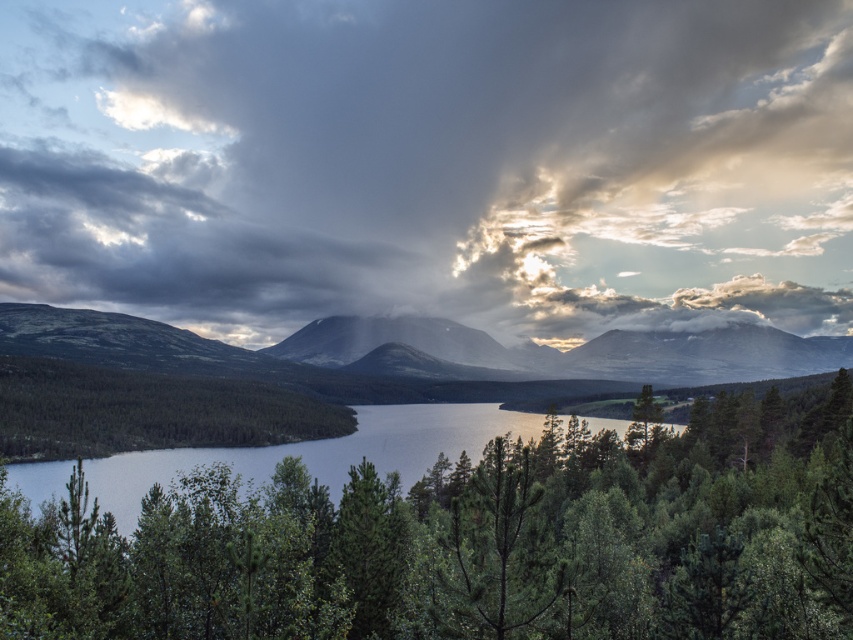
Consider the image. Can you confirm if green leafy tree at center is taller than smooth gray mountain at center?

No, green leafy tree at center is not taller than smooth gray mountain at center.

Does green leafy tree at center appear on the right side of smooth gray mountain at center?

Incorrect, green leafy tree at center is not on the right side of smooth gray mountain at center.

Where is `green leafy tree at center`? The image size is (853, 640). green leafy tree at center is located at coordinates (474, 540).

Which of these two, smooth gray mountain at center or greenish-blue water at center, stands shorter?

greenish-blue water at center is shorter.

Which is behind, point (184, 332) or point (230, 465)?

Point (184, 332)

Which is in front, point (781, 348) or point (111, 467)?

Point (111, 467)

Identify the location of smooth gray mountain at center. The image size is (853, 640). (421, 349).

Who is lower down, green leafy tree at center or greenish-blue water at center?

greenish-blue water at center is below.

Can you confirm if green leafy tree at center is shorter than greenish-blue water at center?

Correct, green leafy tree at center is not as tall as greenish-blue water at center.

Locate an element on the screen. green leafy tree at center is located at coordinates (474, 540).